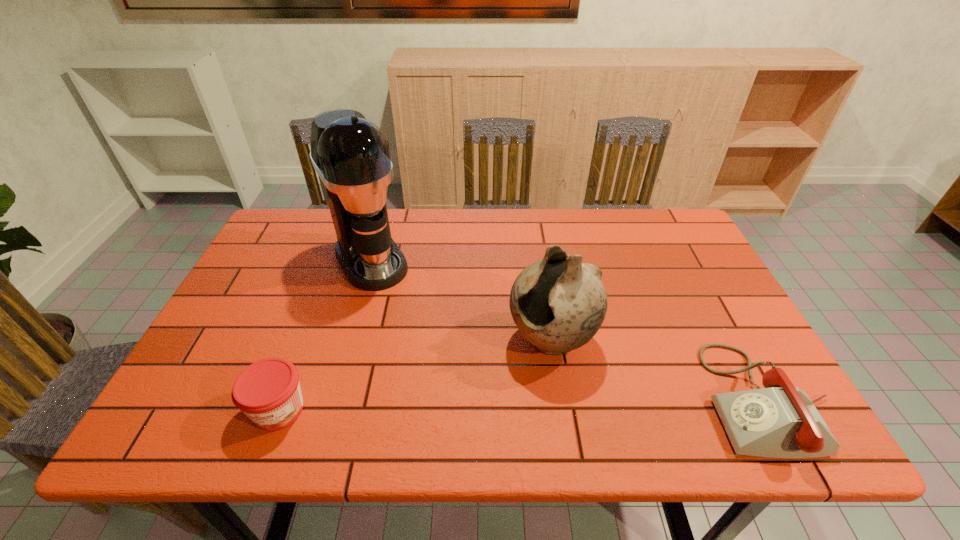
Find the location of a particular element. Image resolution: width=960 pixels, height=540 pixels. jam is located at coordinates (268, 391).

You are a GUI agent. You are given a task and a screenshot of the screen. Output one action in this format:
    pyautogui.click(x=<x>, y=<y>)
    Task: Click on the rightmost object
    The height and width of the screenshot is (540, 960).
    Given the screenshot: What is the action you would take?
    pyautogui.click(x=780, y=421)

The image size is (960, 540). I want to click on the tallest object, so coord(351,155).

Locate an element on the screen. coffee maker is located at coordinates (351, 155).

The height and width of the screenshot is (540, 960). What are the coordinates of `pottery` in the screenshot? It's located at tap(558, 303).

The height and width of the screenshot is (540, 960). I want to click on the second object from right to left, so click(558, 303).

Locate an element on the screen. This screenshot has height=540, width=960. vacant space located 0.210m on the dial of the telephone is located at coordinates (611, 400).

Identify the location of blank space located on the dial of the telephone. (620, 400).

The image size is (960, 540). In order to click on vacant region located 0.160m on the dial of the telephone in this screenshot , I will do `click(635, 400)`.

This screenshot has width=960, height=540. What are the coordinates of `free space located place cup under the spout of the coffee maker` in the screenshot? It's located at (434, 367).